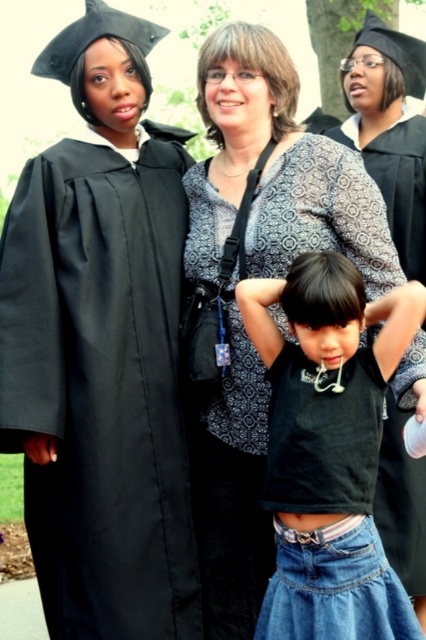
Question: Which object appears closest to the camera in this image?

Choices:
 (A) black matte gown at left
 (B) black cotton shirt at center
 (C) patterned fabric dress at center

Answer: (B)

Question: Does black matte gown at left have a lesser width compared to black cotton shirt at center?

Choices:
 (A) yes
 (B) no

Answer: (B)

Question: Which point is farther from the camera taking this photo?

Choices:
 (A) (414, 241)
 (B) (307, 572)
 (C) (63, 580)

Answer: (A)

Question: Which point is closer to the camera?

Choices:
 (A) (417, 477)
 (B) (379, 540)

Answer: (B)

Question: Does black matte gown at left appear on the right side of patterned fabric dress at center?

Choices:
 (A) yes
 (B) no

Answer: (B)

Question: Is black cotton shirt at center further to the viewer compared to patterned fabric dress at center?

Choices:
 (A) yes
 (B) no

Answer: (B)